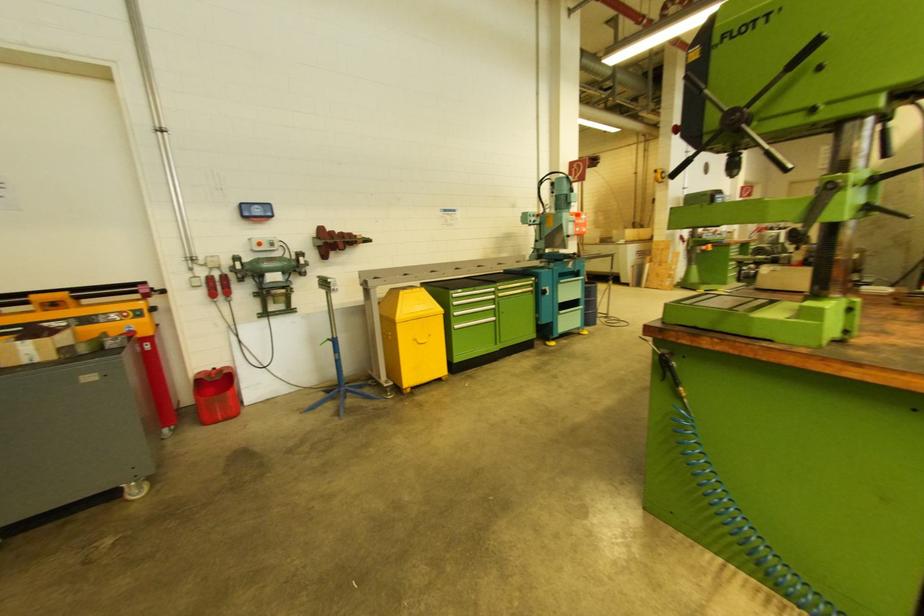
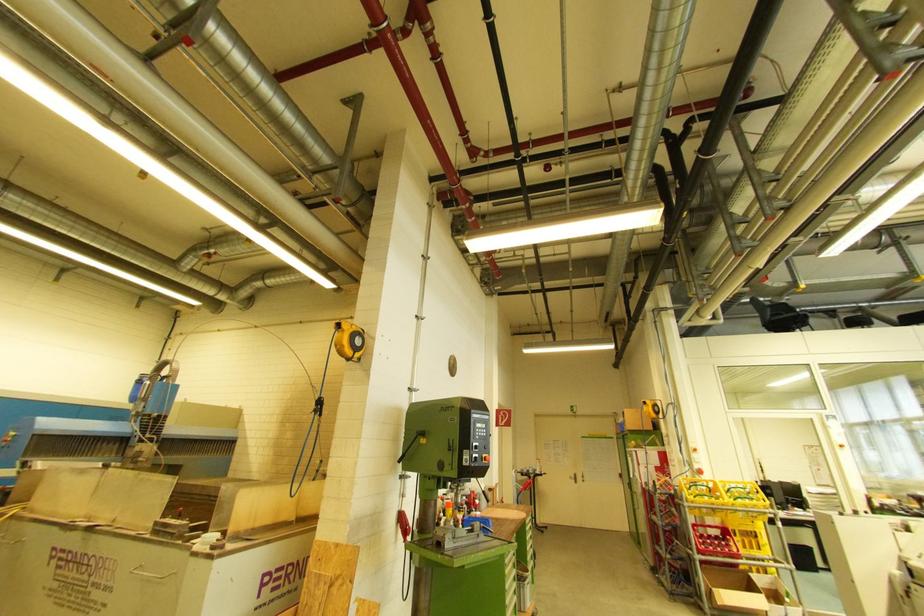
In the second image, find the point that corresponds to [684,238] in the first image.

(404, 519)